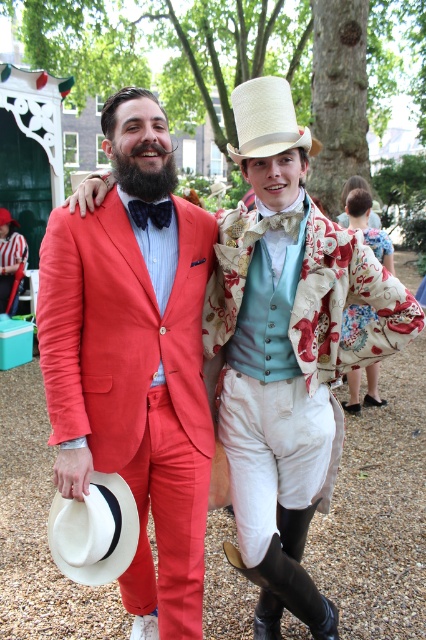
Which is behind, point (282, 221) or point (158, 202)?

Point (282, 221)

Which is more to the right, matte black bow tie at center or velvet bow tie at center?

From the viewer's perspective, matte black bow tie at center appears more on the right side.

Is point (294, 228) more distant than point (138, 208)?

That is True.

Identify the location of matte black bow tie at center. (275, 225).

Does matte red suit at left appear on the right side of velvet bow tie at center?

No, matte red suit at left is not to the right of velvet bow tie at center.

Where is `matte red suit at left`? The height and width of the screenshot is (640, 426). matte red suit at left is located at coordinates (135, 360).

The height and width of the screenshot is (640, 426). I want to click on matte red suit at left, so click(x=135, y=360).

What do you see at coordinates (135, 360) in the screenshot?
I see `matte red suit at left` at bounding box center [135, 360].

Based on the photo, who is positioned more to the right, matte red suit at left or white straw cowboy hat at upper center?

white straw cowboy hat at upper center

Who is more distant from viewer, (149, 548) or (264, 140)?

The point (149, 548) is more distant.

The image size is (426, 640). I want to click on matte red suit at left, so click(135, 360).